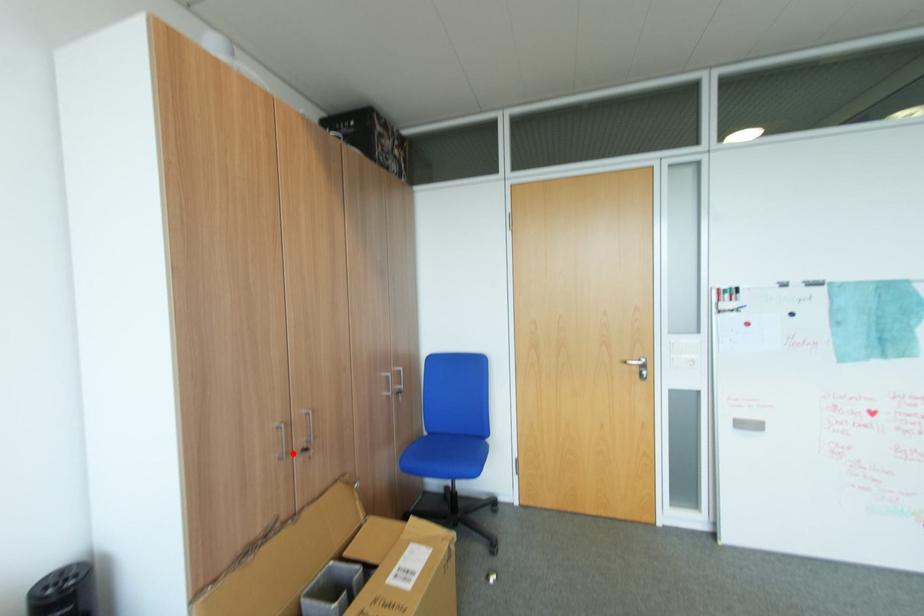
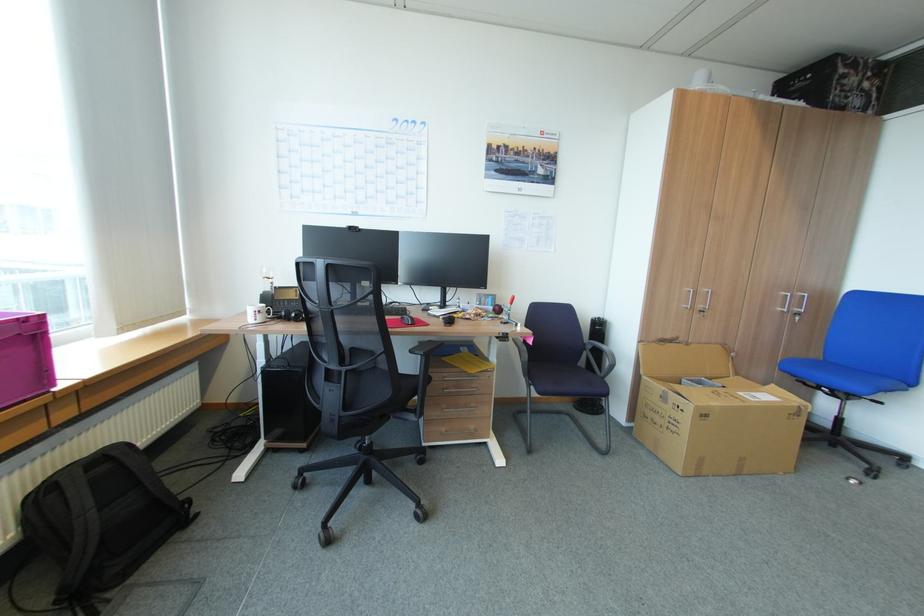
Find the pixel in the second image that matches the highlighted location in the first image.

(698, 307)